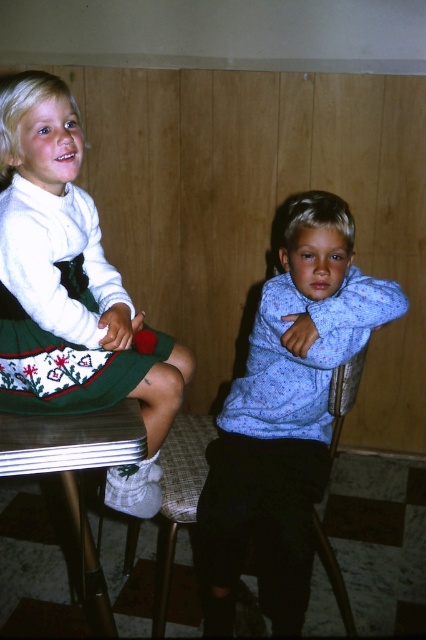
Can you confirm if blue speckled sweater at center is positioned above green knitted dress at upper left?

No.

Can you confirm if blue speckled sweater at center is thinner than green knitted dress at upper left?

No, blue speckled sweater at center is not thinner than green knitted dress at upper left.

What do you see at coordinates (284, 417) in the screenshot? I see `blue speckled sweater at center` at bounding box center [284, 417].

Identify the location of blue speckled sweater at center. Image resolution: width=426 pixels, height=640 pixels. pyautogui.click(x=284, y=417).

Who is taller, blue speckled sweater at center or matte green skirt at left?

Standing taller between the two is blue speckled sweater at center.

Find the location of a particular element. The height and width of the screenshot is (640, 426). blue speckled sweater at center is located at coordinates (284, 417).

Is point (271, 458) behind point (178, 522)?

Yes, point (271, 458) is behind point (178, 522).

Identify the location of blue speckled sweater at center. (284, 417).